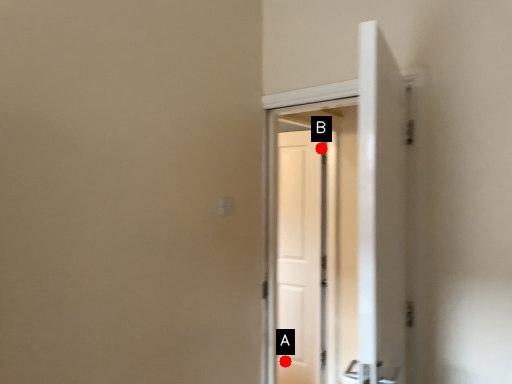
Question: Two points are circled on the image, labeled by A and B beside each circle. Which point is closer to the camera?

Choices:
 (A) A is closer
 (B) B is closer

Answer: (B)